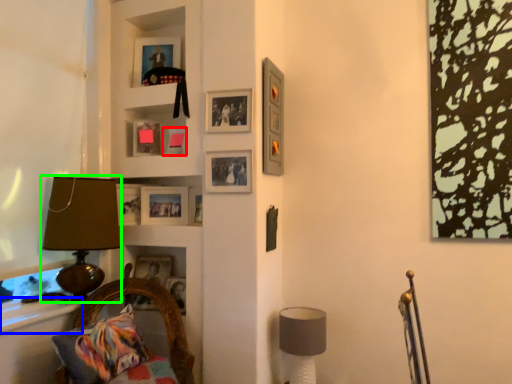
Question: Based on their relative distances, which object is farther from picture frame (highlighted by a red box)? Choose from window sill (highlighted by a blue box) and table lamp (highlighted by a green box).

Choices:
 (A) window sill
 (B) table lamp

Answer: (A)